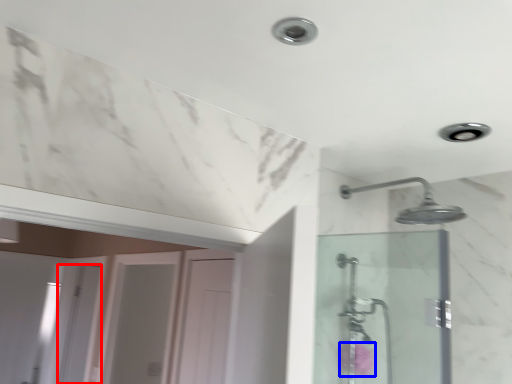
Question: Which point is further to the camera, screen door (highlighted by a red box) or flower (highlighted by a blue box)?

Choices:
 (A) screen door
 (B) flower

Answer: (A)